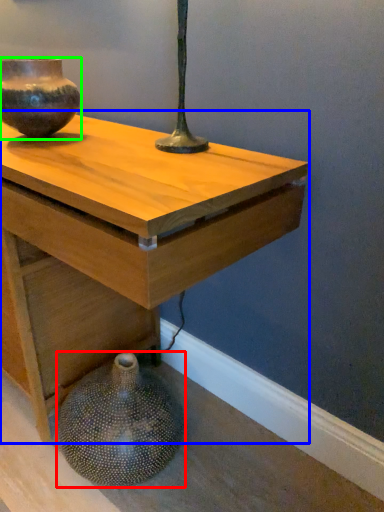
Question: Which object is the farthest from vase (highlighted by a red box)? Choose among these: table (highlighted by a blue box) or vase (highlighted by a green box).

Choices:
 (A) table
 (B) vase

Answer: (B)